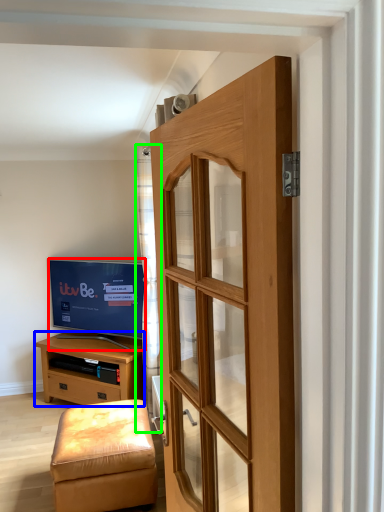
Question: Which object is positioned closest to television (highlighted by a red box)? Select from chest of drawers (highlighted by a blue box) and curtain (highlighted by a green box).

Choices:
 (A) chest of drawers
 (B) curtain

Answer: (A)